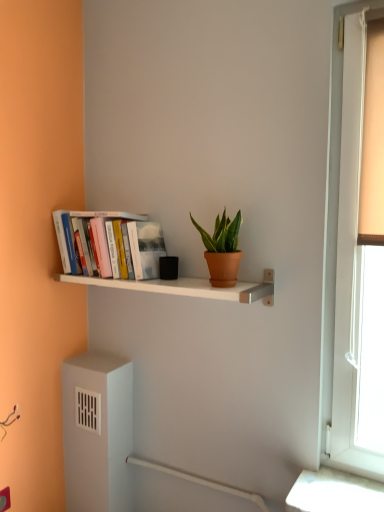
Question: Choose the correct answer: Is terracotta clay pot at center inside white matte shelf at center or outside it?

Choices:
 (A) outside
 (B) inside

Answer: (A)

Question: Is terracotta clay pot at center bigger or smaller than white matte shelf at center?

Choices:
 (A) small
 (B) big

Answer: (A)

Question: Which object is the farthest from the terracotta clay pot at center?

Choices:
 (A) hardcover books at left
 (B) white matte shelf at center

Answer: (A)

Question: Estimate the real-world distances between objects in this image. Which object is farther from the hardcover books at left?

Choices:
 (A) white matte shelf at center
 (B) terracotta clay pot at center

Answer: (B)